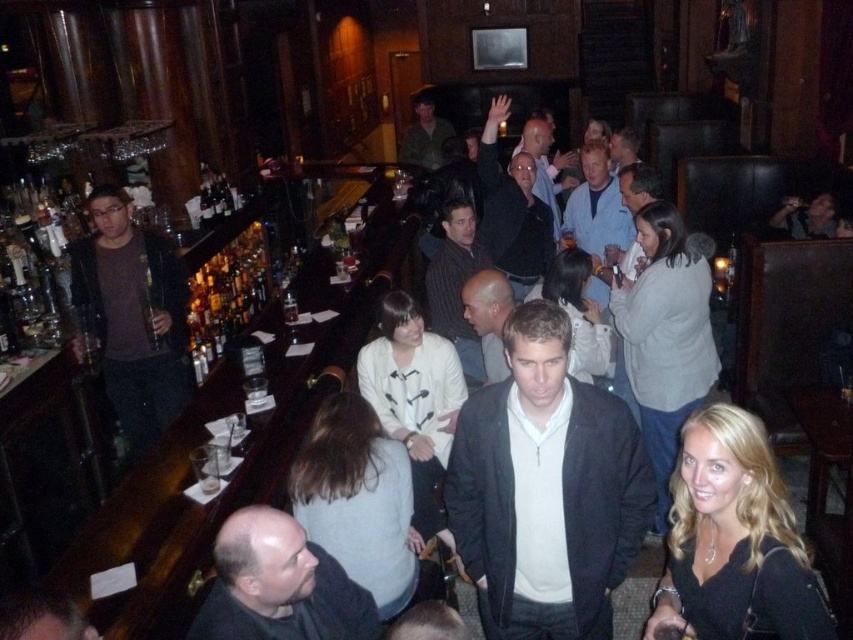
You are a bartender who needs to place a small tray between the matte black jacket at center and the dark blue sweater at center. Based on their heights, which object should the tray be placed closer to?

The tray should be placed closer to the dark blue sweater at center because it has a greater height than the matte black jacket at center.

You are standing at the entrance of the bar and want to greet the person wearing the striped shirt at center. According to the coordinates provided in the Objects Description, in which direction should you walk to reach them?

The striped shirt at center is located at coordinates point (456, 284). Since the coordinates are relative to the image, moving towards the center area of the bar would lead you to the person wearing the striped shirt at center.

You are a customer at the bar and want to order a drink. You notice two people at the center of the bar counter. One is wearing a matte black jacket at center, and the other has light brown hair at center. If you want to approach the person who is closer to the bartender, which one should you approach?

The matte black jacket at center is closer to the bartender because its width surpasses that of the light brown hair at center, indicating it is positioned nearer.